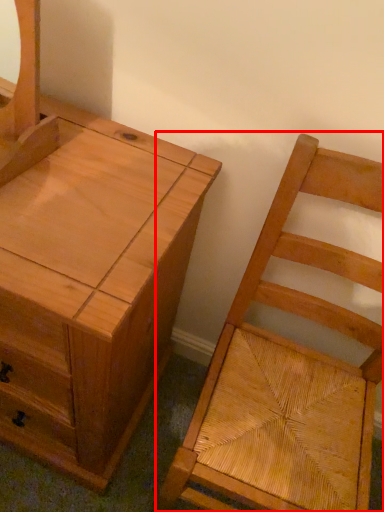
Question: From the image's perspective, what is the correct spatial relationship of chair (annotated by the red box) in relation to chest of drawers?

Choices:
 (A) above
 (B) below

Answer: (B)